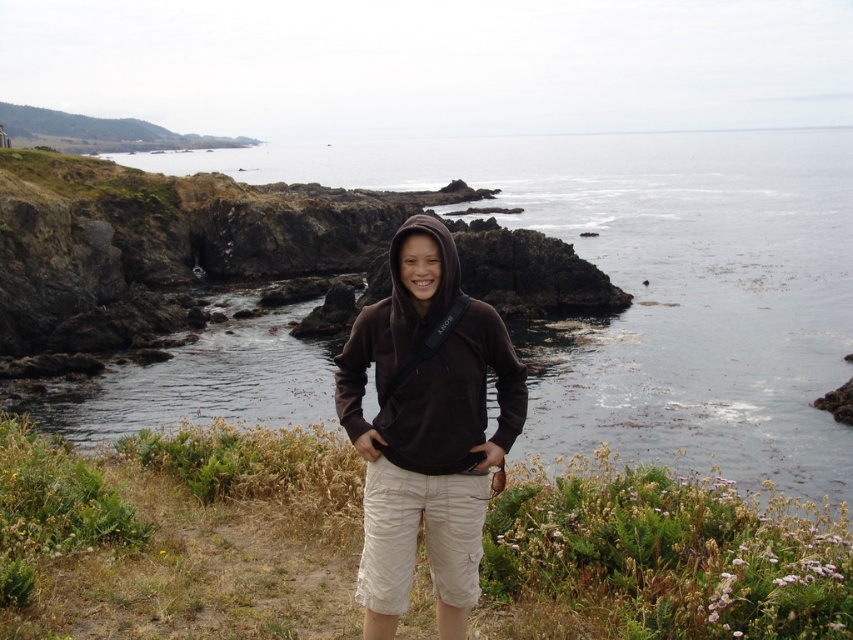
Between clear water at center and brown cotton hoodie at center, which one is positioned higher?

Positioned higher is clear water at center.

Is clear water at center thinner than brown cotton hoodie at center?

In fact, clear water at center might be wider than brown cotton hoodie at center.

Measure the distance between point (x=659, y=365) and camera.

Point (x=659, y=365) is 21.64 meters away from camera.

Locate an element on the screen. The height and width of the screenshot is (640, 853). clear water at center is located at coordinates (657, 282).

Does clear water at center lie in front of brown fleece hoodie at center?

No, it is behind brown fleece hoodie at center.

Is clear water at center taller than brown fleece hoodie at center?

Correct, clear water at center is much taller as brown fleece hoodie at center.

Who is more forward, [798,148] or [439,262]?

Point [439,262] is in front.

This screenshot has height=640, width=853. In order to click on clear water at center in this screenshot , I will do `click(657, 282)`.

Who is positioned more to the left, brown cotton hoodie at center or brown fleece hoodie at center?

brown fleece hoodie at center is more to the left.

Does brown cotton hoodie at center appear over brown fleece hoodie at center?

Incorrect, brown cotton hoodie at center is not positioned above brown fleece hoodie at center.

The height and width of the screenshot is (640, 853). Describe the element at coordinates (178, 534) in the screenshot. I see `brown cotton hoodie at center` at that location.

At what (x,y) coordinates should I click in order to perform the action: click on brown cotton hoodie at center. Please return your answer as a coordinate pair (x, y). Looking at the image, I should click on (178, 534).